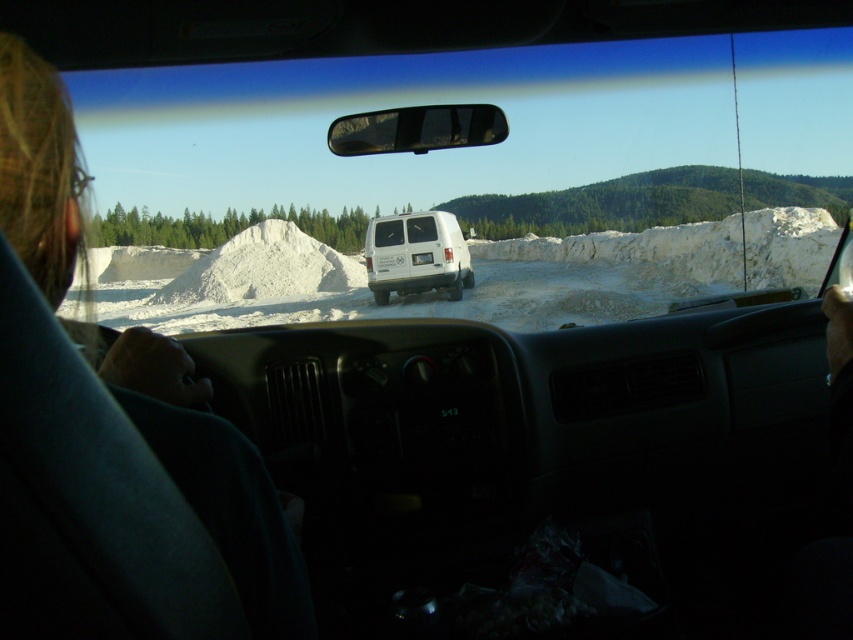
Question: Which point appears closest to the camera in this image?

Choices:
 (A) (776, 269)
 (B) (372, 218)
 (C) (308, 246)
 (D) (257, 637)

Answer: (D)

Question: Which object is positioned farthest from the blonde hair at left?

Choices:
 (A) transparent glass car window at center
 (B) white matte van at center

Answer: (A)

Question: Is transparent glass car window at center below white matte van at center?

Choices:
 (A) no
 (B) yes

Answer: (A)

Question: Does blonde hair at left have a greater width compared to white matte van at center?

Choices:
 (A) yes
 (B) no

Answer: (B)

Question: Which of the following is the farthest from the observer?

Choices:
 (A) (268, 276)
 (B) (302, 173)

Answer: (B)

Question: From the image, what is the correct spatial relationship of blonde hair at left in relation to white matte van at center?

Choices:
 (A) right
 (B) left

Answer: (B)